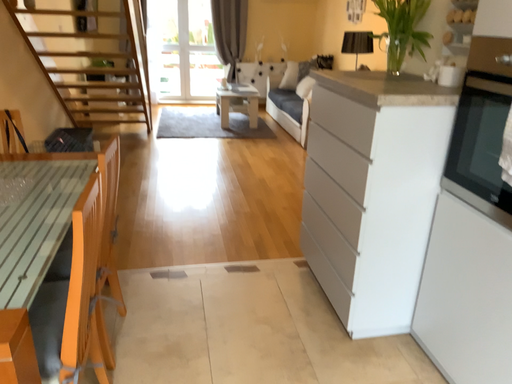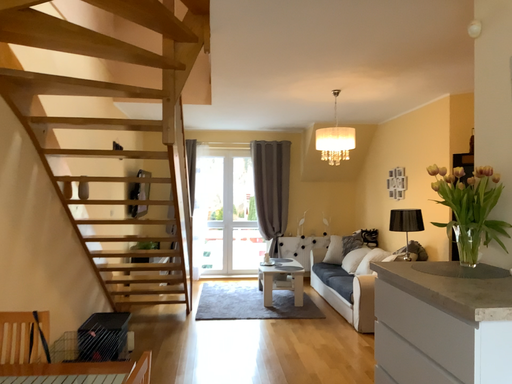
Question: How did the camera likely rotate when shooting the video?

Choices:
 (A) rotated upward
 (B) rotated downward

Answer: (A)